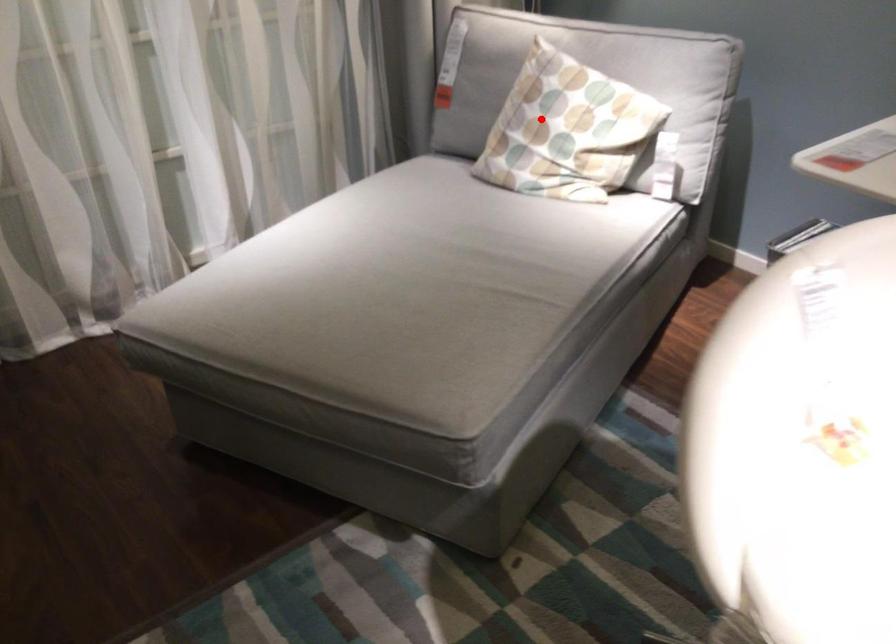
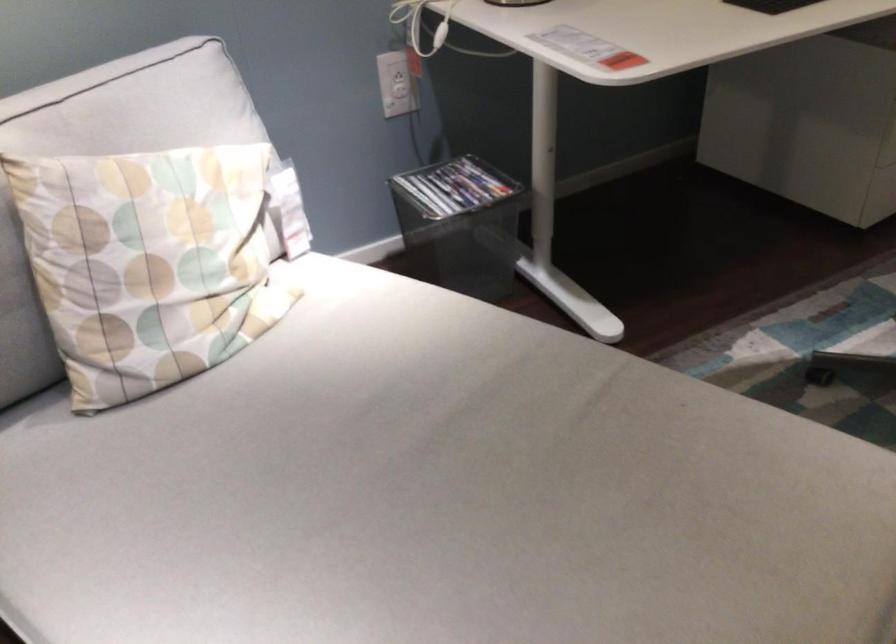
Locate, in the second image, the point that corresponds to the highlighted location in the first image.

(149, 263)